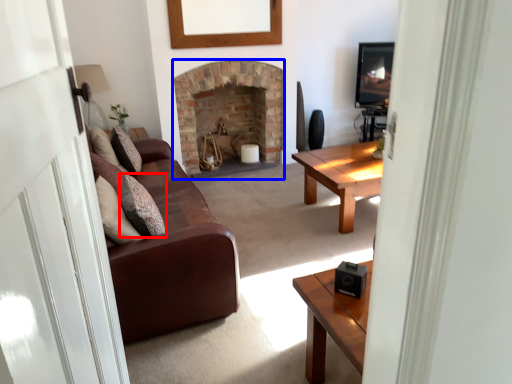
Question: Among these objects, which one is nearest to the camera, pillow (highlighted by a red box) or fireplace (highlighted by a blue box)?

Choices:
 (A) pillow
 (B) fireplace

Answer: (A)